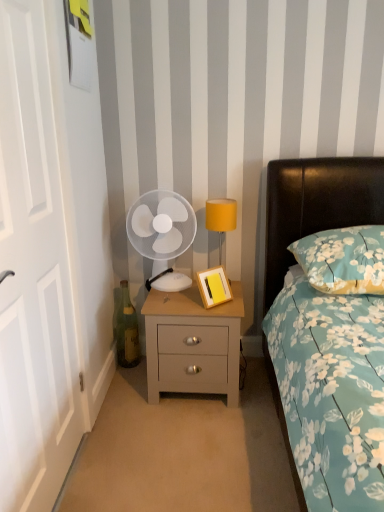
Question: Looking at the image, does white plastic fan at center seem bigger or smaller compared to teal floral fabric bed at right?

Choices:
 (A) small
 (B) big

Answer: (A)

Question: Considering the positions of white plastic fan at center and teal floral fabric bed at right in the image, is white plastic fan at center wider or thinner than teal floral fabric bed at right?

Choices:
 (A) thin
 (B) wide

Answer: (A)

Question: Estimate the real-world distances between objects in this image. Which object is farther from the white plastic fan at center?

Choices:
 (A) wooden picture frame at bedside table
 (B) floral fabric pillow at right
 (C) white wooden door at left
 (D) light wood/texture nightstand at center
 (E) yellow fabric lampshade at upper right

Answer: (C)

Question: Which is nearer to the green glass bottle at lower left?

Choices:
 (A) yellow fabric lampshade at upper right
 (B) white wooden door at left
 (C) floral fabric pillow at right
 (D) teal floral fabric bed at right
 (E) wooden picture frame at bedside table

Answer: (E)